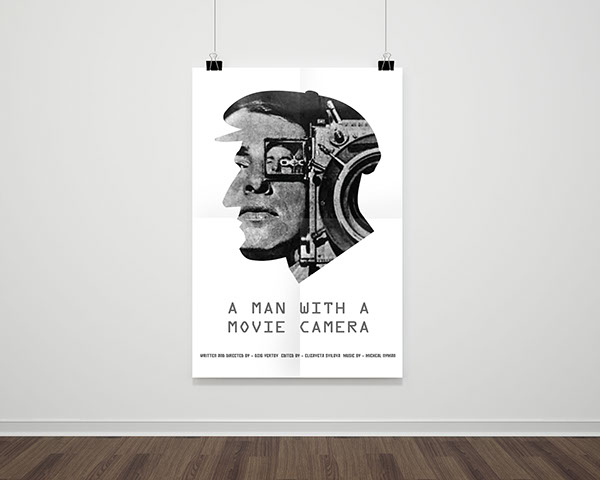
Where is `poster`? Image resolution: width=600 pixels, height=480 pixels. poster is located at coordinates (303, 200).